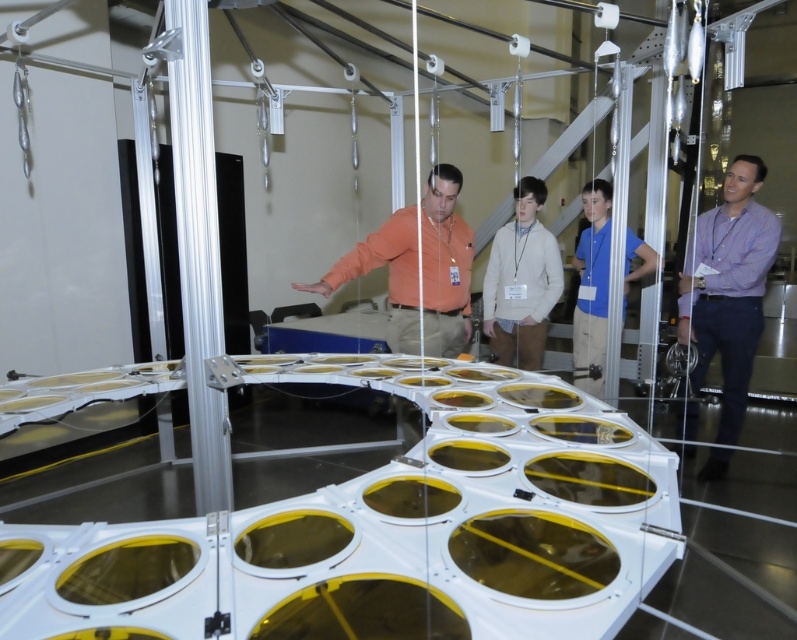
Can you confirm if purple shirt at right is positioned below white sweater at center?

Yes, purple shirt at right is below white sweater at center.

Consider the image. How distant is purple shirt at right from white sweater at center?

purple shirt at right and white sweater at center are 37.01 inches apart from each other.

Describe the element at coordinates (729, 288) in the screenshot. I see `purple shirt at right` at that location.

I want to click on purple shirt at right, so click(729, 288).

Which is below, purple shirt at right or blue shirt at center?

purple shirt at right is below.

Between purple shirt at right and blue shirt at center, which one is positioned higher?

Positioned higher is blue shirt at center.

This screenshot has height=640, width=797. I want to click on purple shirt at right, so click(x=729, y=288).

The height and width of the screenshot is (640, 797). Identify the location of purple shirt at right. (729, 288).

Does white sweater at center appear under blue shirt at center?

No, white sweater at center is not below blue shirt at center.

Is white sweater at center above blue shirt at center?

Indeed, white sweater at center is positioned over blue shirt at center.

You are a GUI agent. You are given a task and a screenshot of the screen. Output one action in this format:
    pyautogui.click(x=<x>, y=<y>)
    Task: Click on the white sweater at center
    The height and width of the screenshot is (640, 797).
    Given the screenshot: What is the action you would take?
    pyautogui.click(x=521, y=282)